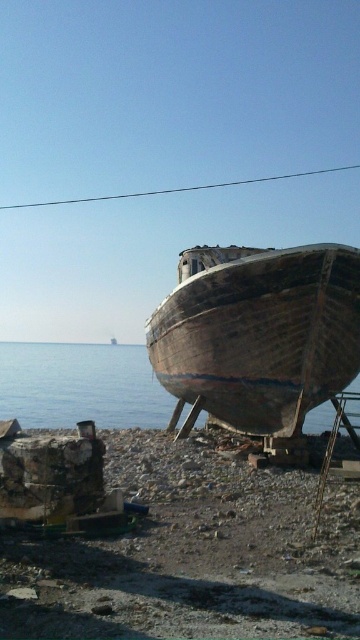
You are a marine inspector assessing the scene. You need to determine which boat is higher in elevation between the rusty metallic boat at lower right and the weathered wood boat at center. Based on the provided information, which boat is taller?

The rusty metallic boat at lower right is taller than the weathered wood boat at center.

You are standing at the point marked as point (194,554) in the image. Looking around, you see a rusty metallic boat at lower right. What object is located exactly at your current position?

The point (194,554) is exactly where you are standing.

You are standing on the rocky shore and see the point at coordinates (194, 554). What object is located at that point?

The point at coordinates (194, 554) corresponds to the rusty metallic boat at lower right.